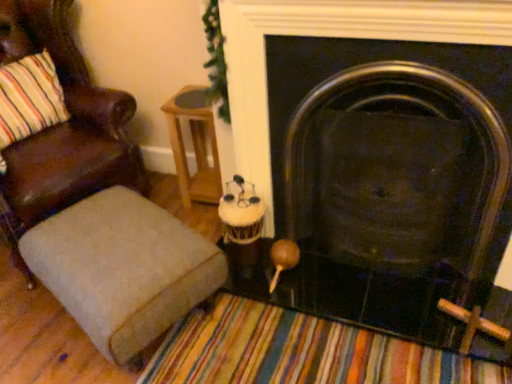
Question: Should I look upward or downward to see brown leather chair at left?

Choices:
 (A) down
 (B) up

Answer: (B)

Question: Could you tell me if black metal fireplace at center is turned towards brown leather chair at left?

Choices:
 (A) no
 (B) yes

Answer: (A)

Question: Is black metal fireplace at center positioned in front of brown leather chair at left?

Choices:
 (A) yes
 (B) no

Answer: (A)

Question: Is black metal fireplace at center far away from brown leather chair at left?

Choices:
 (A) yes
 (B) no

Answer: (B)

Question: Considering the relative sizes of black metal fireplace at center and brown leather chair at left in the image provided, is black metal fireplace at center taller than brown leather chair at left?

Choices:
 (A) no
 (B) yes

Answer: (A)

Question: Is black metal fireplace at center not inside brown leather chair at left?

Choices:
 (A) no
 (B) yes

Answer: (B)

Question: Would you say brown leather chair at left is part of black metal fireplace at center's contents?

Choices:
 (A) no
 (B) yes

Answer: (A)

Question: Is woodenside table at center located outside textured beige ottoman at lower left?

Choices:
 (A) yes
 (B) no

Answer: (A)

Question: Considering the relative sizes of woodenside table at center and textured beige ottoman at lower left in the image provided, is woodenside table at center smaller than textured beige ottoman at lower left?

Choices:
 (A) no
 (B) yes

Answer: (B)

Question: Considering the relative sizes of woodenside table at center and textured beige ottoman at lower left in the image provided, is woodenside table at center taller than textured beige ottoman at lower left?

Choices:
 (A) no
 (B) yes

Answer: (B)

Question: From the image's perspective, is woodenside table at center above textured beige ottoman at lower left?

Choices:
 (A) yes
 (B) no

Answer: (A)

Question: From a real-world perspective, is woodenside table at center beneath textured beige ottoman at lower left?

Choices:
 (A) yes
 (B) no

Answer: (B)

Question: Is textured beige ottoman at lower left surrounded by woodenside table at center?

Choices:
 (A) no
 (B) yes

Answer: (A)

Question: Is brown leather chair at left to the right of textured beige ottoman at lower left from the viewer's perspective?

Choices:
 (A) yes
 (B) no

Answer: (B)